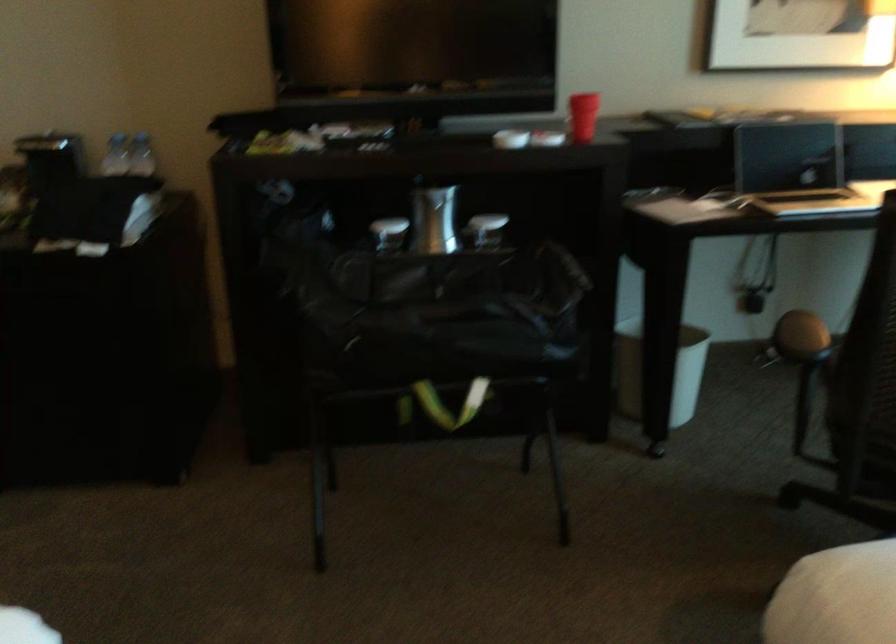
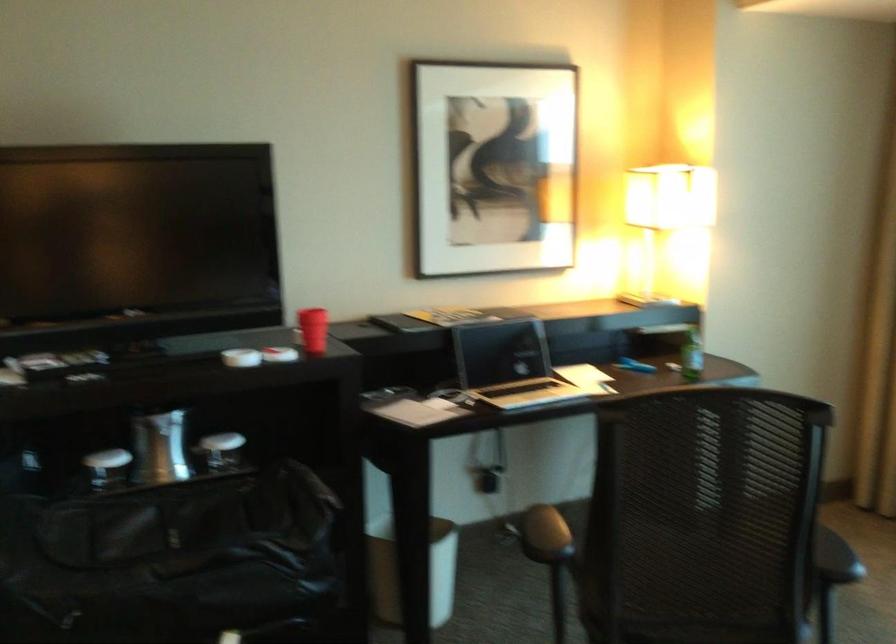
In a continuous first-person perspective shot, in which direction is the camera moving?

The cameraman walked toward left, forward.